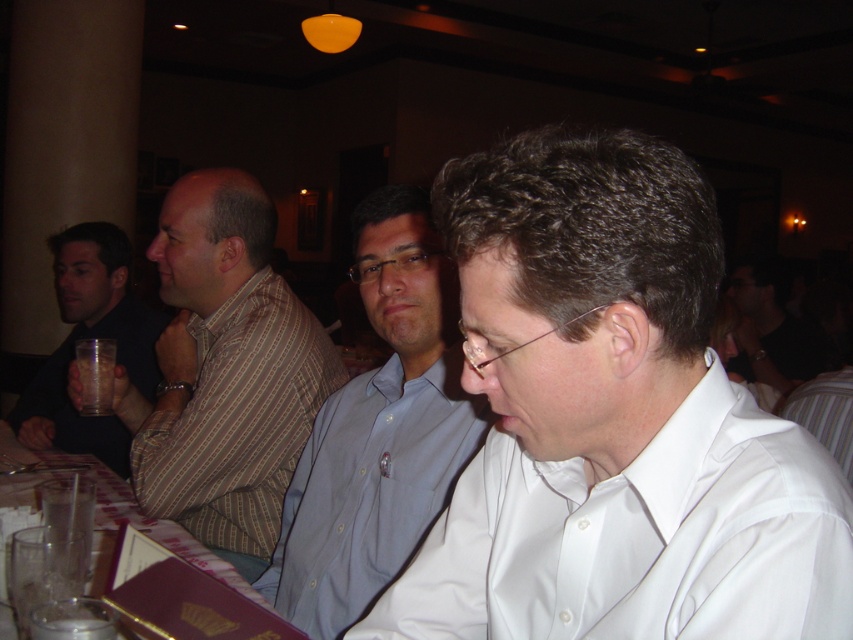
Question: Which object is closer to the camera taking this photo?

Choices:
 (A) striped cotton shirt at left
 (B) translucent glass water at lower left

Answer: (B)

Question: Is striped cotton shirt at left to the right of clear plastic cup at left from the viewer's perspective?

Choices:
 (A) yes
 (B) no

Answer: (A)

Question: Can you confirm if blue button-down shirt at center is thinner than dark blue shirt at left?

Choices:
 (A) yes
 (B) no

Answer: (A)

Question: Which point is farther from the camera taking this photo?

Choices:
 (A) (132, 380)
 (B) (173, 509)
 (C) (109, 348)
 (D) (357, 500)

Answer: (A)

Question: Is white button-down shirt at center further to camera compared to clear plastic cup at left?

Choices:
 (A) yes
 (B) no

Answer: (B)

Question: Which point is farther to the camera?

Choices:
 (A) (136, 349)
 (B) (262, 604)
 (C) (79, 412)
 (D) (633, 387)

Answer: (A)